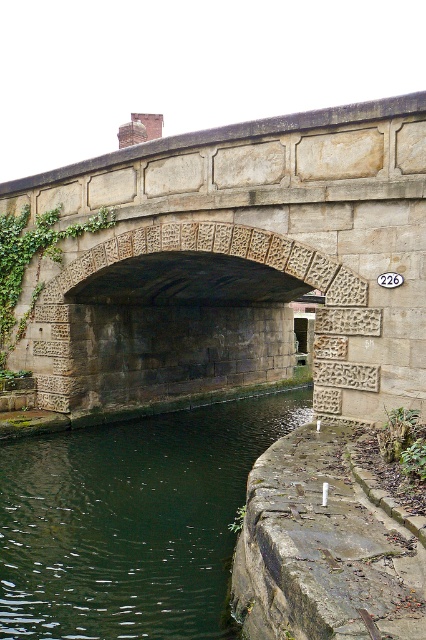
You are standing on the stone bridge and see the green stone water at lower left and the green ivy at center. Which one is located to the right of the other?

The green stone water at lower left is positioned on the right side of green ivy at center, so the green stone water at lower left is to the right of the green ivy at center.

You are standing on the stone textured bridge at center and want to take a photo of the green ivy at center. Which direction should you face to capture the ivy in your shot?

Since the stone textured bridge at center is in front of green ivy at center, you should face backward to take a photo of the green ivy at center.

You are a painter standing on the stone bridge and want to paint both the green stone water at lower left and the green ivy at center. If your painting canvas is 1.5 meters wide, can you fit both objects into your canvas at the same time?

The green stone water at lower left and green ivy at center are 6.00 meters apart from each other. Since the canvas is only 1.5 meters wide, the distance between the two objects exceeds the canvas width, so you cannot fit both into the canvas at the same time.